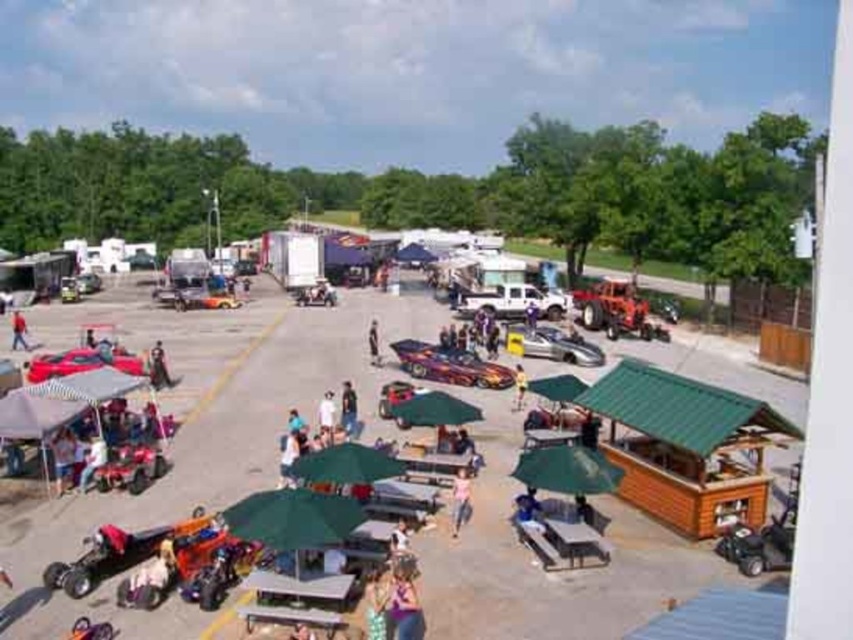
You are standing at the origin point of the coordinate system in the image. You want to find the silver metallic car at center. In which direction should you move to reach it?

The silver metallic car at center is located at coordinates point (552,346). Since you are at the origin, you should move in the positive x and positive y direction to reach it.

You are a photographer at the event and want to capture both the denim pants at center and the light brown leather jacket at center in a single photo. Which object should you focus on first to ensure both are in frame?

You should focus on the denim pants at center first since it is closer to the viewer than the light brown leather jacket at center, ensuring both are in frame.